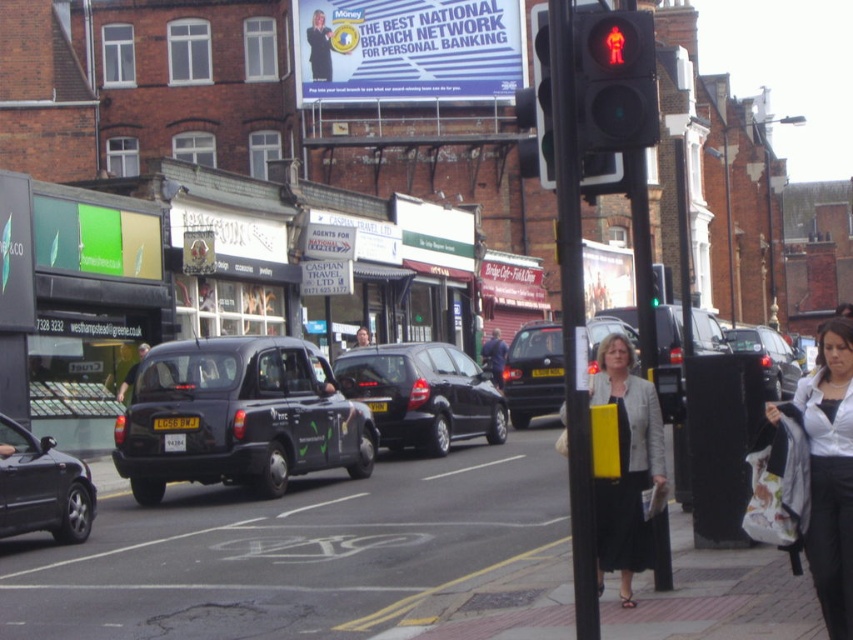
Question: Does black plastic pole at center have a lesser width compared to green glass traffic light at upper center?

Choices:
 (A) yes
 (B) no

Answer: (A)

Question: Which object appears closest to the camera in this image?

Choices:
 (A) green glass traffic light at upper center
 (B) black matte taxi at left
 (C) red glass pedestrian signal at upper right
 (D) matte gray blazer at center

Answer: (C)

Question: Does matte black taxi at center-left appear under matte gray blazer at center?

Choices:
 (A) no
 (B) yes

Answer: (B)

Question: Which of the following is the farthest from the observer?

Choices:
 (A) white fabric jacket at lower right
 (B) black glossy car at center
 (C) smooth black suit at center
 (D) black rubber taxi at center

Answer: (C)

Question: From the image, what is the correct spatial relationship of matte gray blazer at center in relation to red glass pedestrian signal at upper right?

Choices:
 (A) below
 (B) above

Answer: (A)

Question: Which point is farther to the camera?

Choices:
 (A) (363, 328)
 (B) (775, 392)
 (C) (122, 618)

Answer: (A)